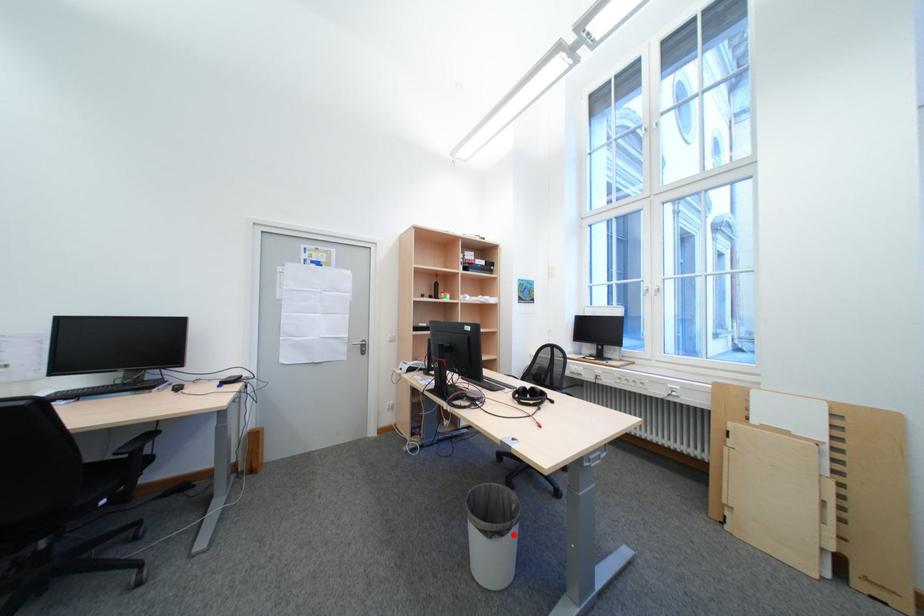
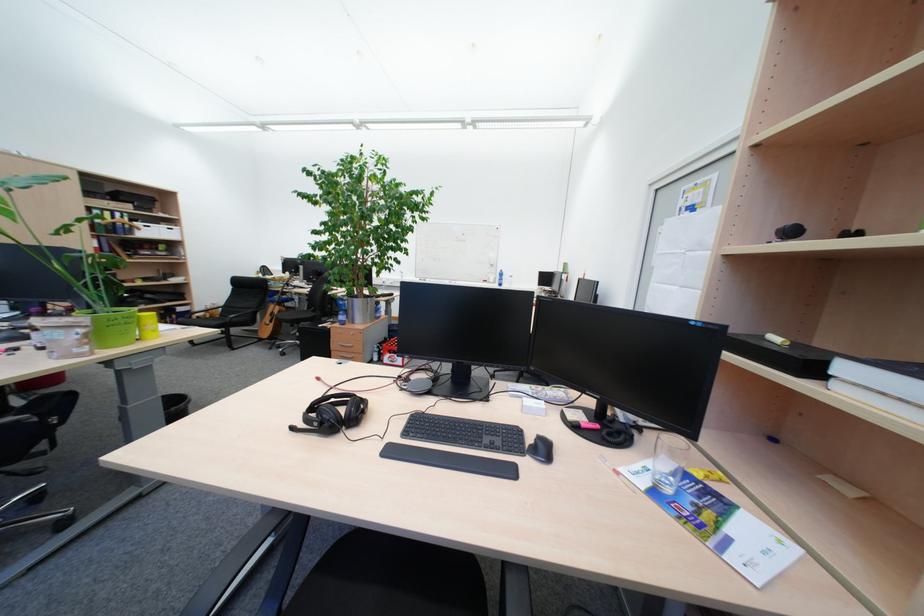
Question: I am providing you with two images of the same scene from different viewpoints. A red point is marked on the first image. At the location where the point appears in image 1, is it still visible in image 2?

Choices:
 (A) Yes
 (B) No

Answer: (B)